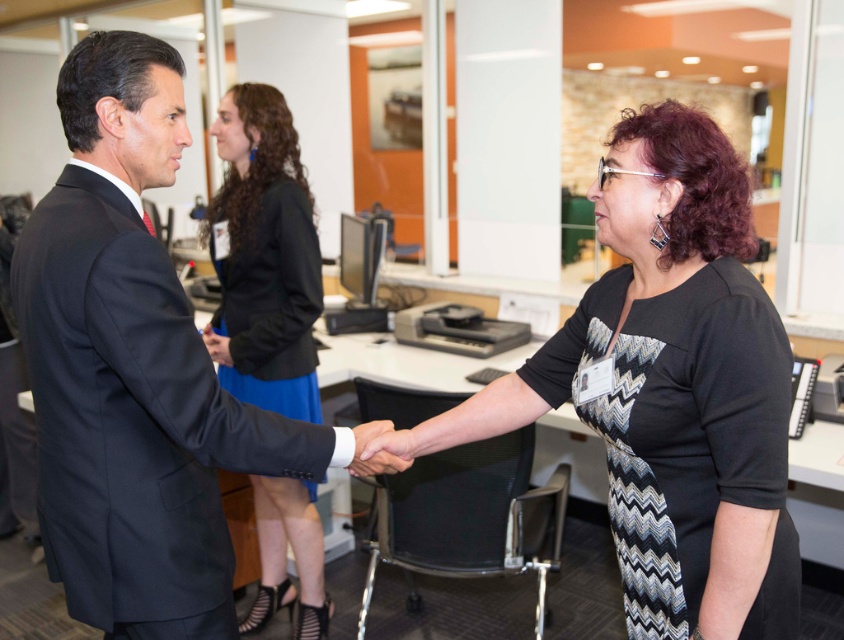
Question: Does shiny black suit at center appear under smooth skin handshake at center?

Choices:
 (A) no
 (B) yes

Answer: (A)

Question: Does black zigzag-patterned dress at center have a greater width compared to matte black hand at center?

Choices:
 (A) yes
 (B) no

Answer: (A)

Question: Can you confirm if blue satin skirt at center is positioned to the right of smooth skin handshake at center?

Choices:
 (A) no
 (B) yes

Answer: (A)

Question: Which of these objects is positioned closest to the black zigzag-patterned dress at center?

Choices:
 (A) matte black hand at center
 (B) blue satin skirt at center

Answer: (B)

Question: Which object is positioned closest to the blue satin skirt at center?

Choices:
 (A) shiny black suit at center
 (B) matte black hand at center
 (C) black zigzag-patterned dress at center

Answer: (B)

Question: Which of the following is the farthest from the observer?

Choices:
 (A) matte black hand at center
 (B) smooth skin handshake at center
 (C) shiny black suit at center

Answer: (A)